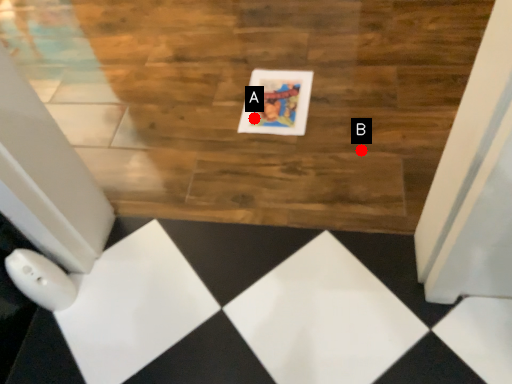
Question: Two points are circled on the image, labeled by A and B beside each circle. Among these points, which one is farthest from the camera?

Choices:
 (A) A is further
 (B) B is further

Answer: (A)